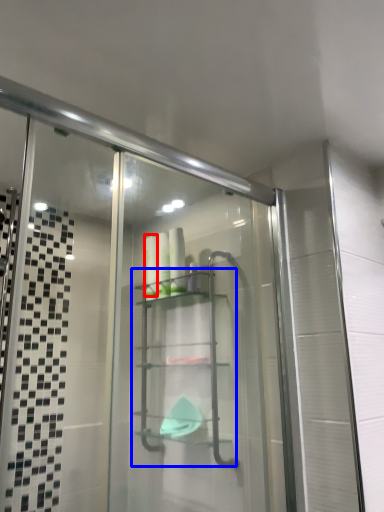
Question: Among these objects, which one is nearest to the camera, toiletry (highlighted by a red box) or glass box (highlighted by a blue box)?

Choices:
 (A) toiletry
 (B) glass box

Answer: (B)